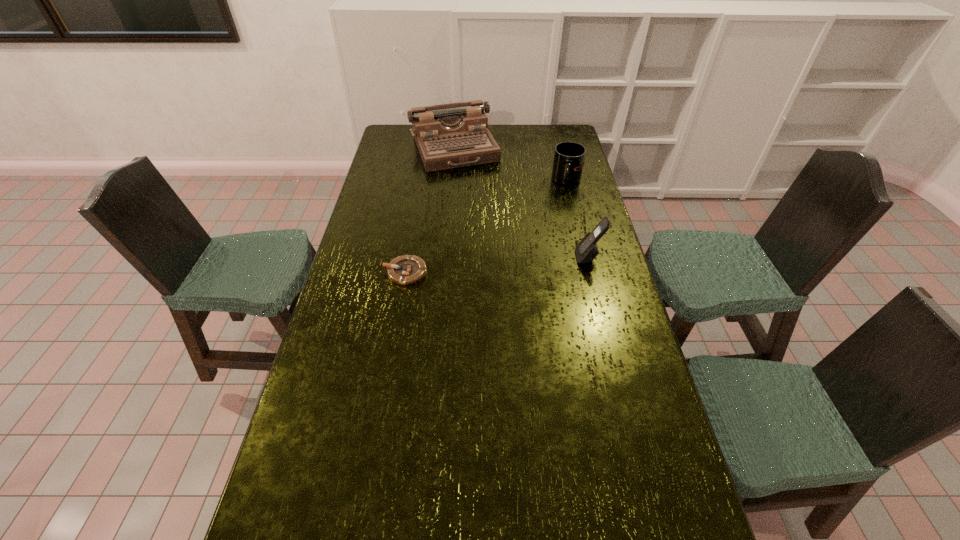
Where is `vacant space at the far edge of the desktop`? vacant space at the far edge of the desktop is located at coordinates (514, 147).

The height and width of the screenshot is (540, 960). Identify the location of free space at the left edge. (366, 204).

Where is `free space at the right edge of the desktop`? This screenshot has width=960, height=540. free space at the right edge of the desktop is located at coordinates (609, 321).

Where is `vacant space at the far left corner`? This screenshot has height=540, width=960. vacant space at the far left corner is located at coordinates (410, 126).

In the image, there is a desktop. Identify the location of vacant space at the near right corner. This screenshot has width=960, height=540. (630, 497).

Identify the location of vacant space that's between the ashtray and the typewriter. The width and height of the screenshot is (960, 540). coord(430,211).

Locate an element on the screen. free spot between the ashtray and the typewriter is located at coordinates (430, 211).

Identify the location of free space between the mug and the typewriter. (511, 165).

Find the location of a particular element. The width and height of the screenshot is (960, 540). free spot between the ashtray and the typewriter is located at coordinates (430, 211).

Identify the location of unoccupied position between the third tallest object and the cellular telephone. (578, 219).